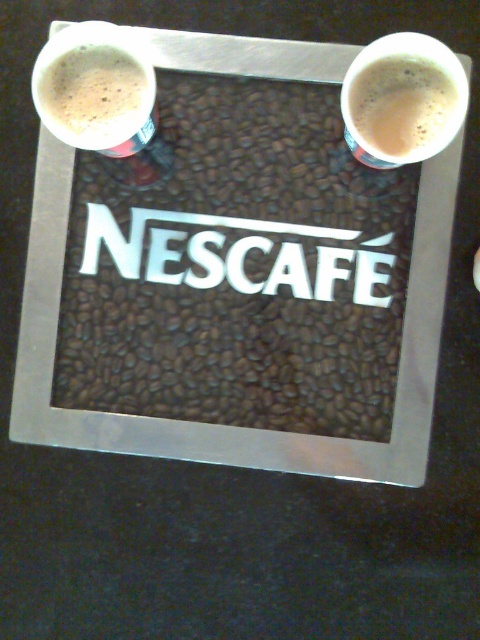
You are standing in front of the Nescafe promotional display. You see a point marked at coordinates (95, 93). What object is located at this point?

The point at coordinates (95, 93) marks the matte white cup at upper left.

You are designing a promotional display for Nescafe and need to place a new label between the matte white cup at upper left and the white frothy coffee at upper right. The label must be centered between them. Considering their widths, which object should the label align with to ensure it stays centered?

The matte white cup at upper left might be wider than white frothy coffee at upper right, so to center the label between them, it should align with the wider matte white cup at upper left to maintain balance.